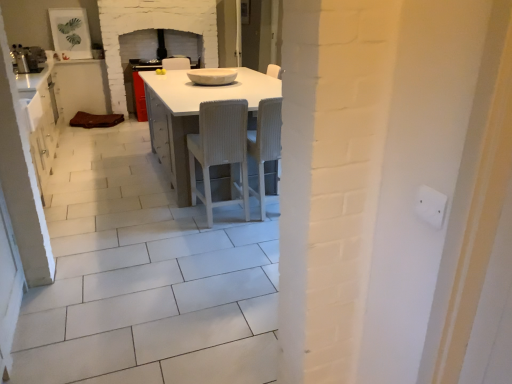
Question: In terms of size, does white glossy bowl at center appear bigger or smaller than white ribbed wood chair at center, which is the first chair in left-to-right order?

Choices:
 (A) big
 (B) small

Answer: (B)

Question: From a real-world perspective, relative to white ribbed wood chair at center, which is the 2th chair from right to left, is white glossy bowl at center vertically above or below?

Choices:
 (A) below
 (B) above

Answer: (B)

Question: Considering the real-world distances, which object is closest to the brown leather cushion at left?

Choices:
 (A) white plastic electric outlet at upper right
 (B) white glossy bowl at center
 (C) white textured chair at center, which appears as the first chair when viewed from the right
 (D) white ribbed wood chair at center, which is the first chair in left-to-right order
 (E) white glossy table at center

Answer: (B)

Question: Considering the real-world distances, which object is closest to the white plastic electric outlet at upper right?

Choices:
 (A) white ribbed wood chair at center, which is the first chair in left-to-right order
 (B) white glossy table at center
 (C) white textured chair at center, the second chair when ordered from left to right
 (D) white glossy bowl at center
 (E) brown leather cushion at left

Answer: (A)